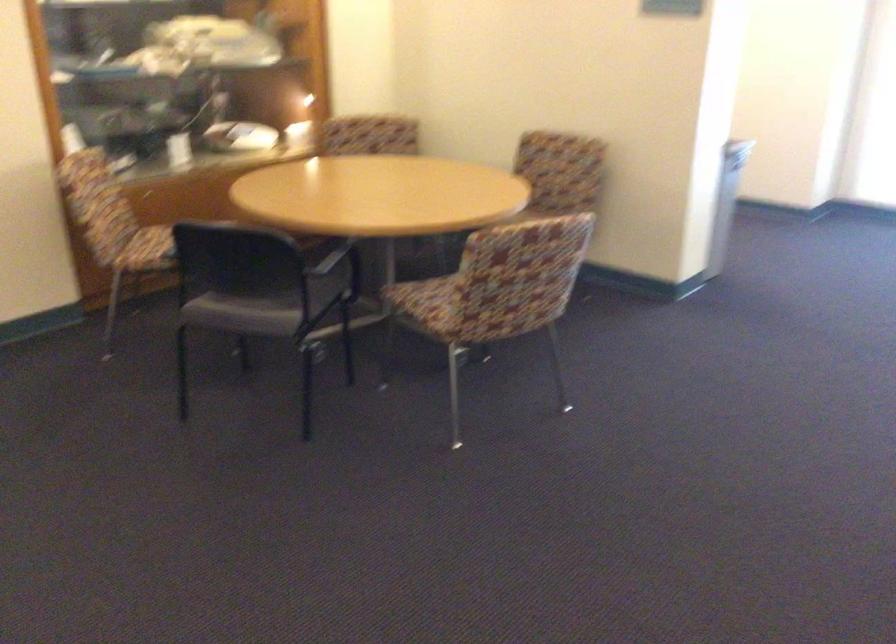
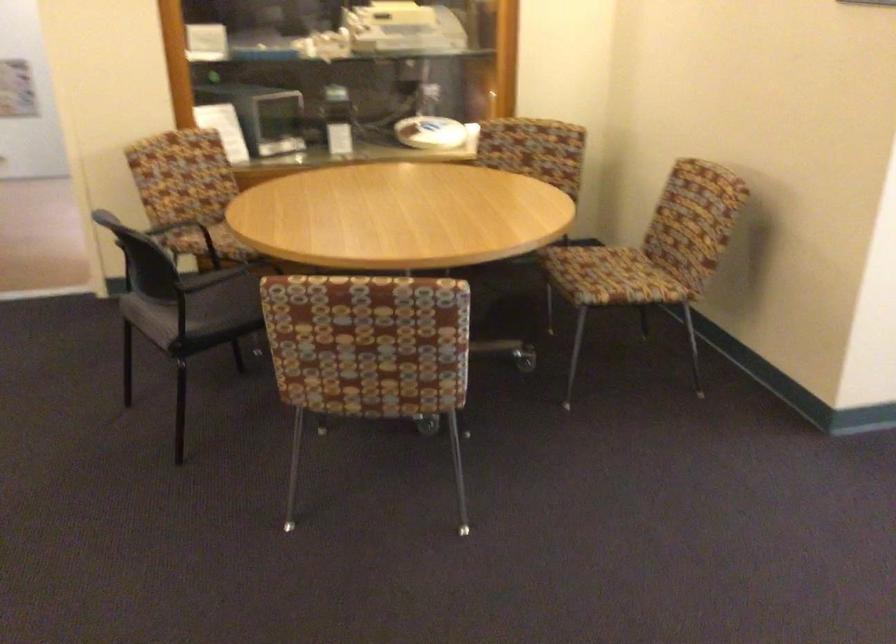
The point at (294, 225) is marked in the first image. Where is the corresponding point in the second image?

(228, 229)